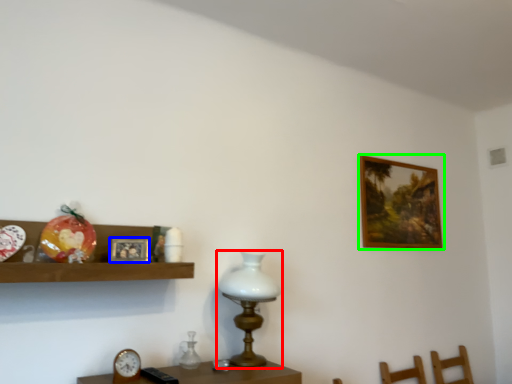
Question: Based on their relative distances, which object is farther from table lamp (highlighted by a red box)? Choose from picture frame (highlighted by a blue box) and picture frame (highlighted by a green box).

Choices:
 (A) picture frame
 (B) picture frame

Answer: (B)